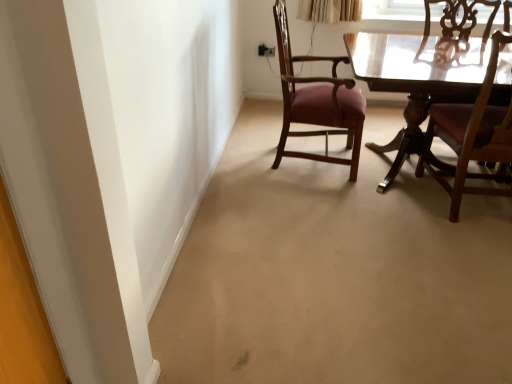
Question: Is wooden chair at right, the second chair viewed from the left, not close to purple upholstered chair at center, the 2th chair from the right?

Choices:
 (A) no
 (B) yes

Answer: (A)

Question: Can you confirm if wooden chair at right, the second chair viewed from the left, is positioned to the left of purple upholstered chair at center, which is counted as the first chair, starting from the left?

Choices:
 (A) no
 (B) yes

Answer: (A)

Question: Considering the relative sizes of wooden chair at right, the second chair viewed from the left, and purple upholstered chair at center, which is counted as the first chair, starting from the left, in the image provided, is wooden chair at right, the second chair viewed from the left, taller than purple upholstered chair at center, which is counted as the first chair, starting from the left,?

Choices:
 (A) no
 (B) yes

Answer: (A)

Question: Is wooden chair at right, placed as the first chair when sorted from right to left, wider than purple upholstered chair at center, which is counted as the first chair, starting from the left?

Choices:
 (A) yes
 (B) no

Answer: (B)

Question: Could you tell me if wooden chair at right, placed as the first chair when sorted from right to left, is turned towards purple upholstered chair at center, the 2th chair from the right?

Choices:
 (A) yes
 (B) no

Answer: (B)

Question: Is wooden chair at right, the second chair viewed from the left, thinner than purple upholstered chair at center, which is counted as the first chair, starting from the left?

Choices:
 (A) no
 (B) yes

Answer: (B)

Question: Considering the relative sizes of purple upholstered chair at center, which is counted as the first chair, starting from the left, and wooden chair at right, the second chair viewed from the left, in the image provided, is purple upholstered chair at center, which is counted as the first chair, starting from the left, shorter than wooden chair at right, the second chair viewed from the left,?

Choices:
 (A) yes
 (B) no

Answer: (B)

Question: Is the depth of purple upholstered chair at center, which is counted as the first chair, starting from the left, greater than that of wooden chair at right, the second chair viewed from the left?

Choices:
 (A) no
 (B) yes

Answer: (B)

Question: Are purple upholstered chair at center, which is counted as the first chair, starting from the left, and wooden chair at right, placed as the first chair when sorted from right to left, far apart?

Choices:
 (A) yes
 (B) no

Answer: (B)

Question: Is the position of purple upholstered chair at center, which is counted as the first chair, starting from the left, less distant than that of wooden chair at right, placed as the first chair when sorted from right to left?

Choices:
 (A) no
 (B) yes

Answer: (A)

Question: Could you tell me if purple upholstered chair at center, which is counted as the first chair, starting from the left, is facing wooden chair at right, placed as the first chair when sorted from right to left?

Choices:
 (A) yes
 (B) no

Answer: (A)

Question: Does purple upholstered chair at center, the 2th chair from the right, have a lesser width compared to wooden chair at right, the second chair viewed from the left?

Choices:
 (A) no
 (B) yes

Answer: (A)

Question: In terms of height, does purple upholstered chair at center, the 2th chair from the right, look taller or shorter compared to wooden chair at right, the second chair viewed from the left?

Choices:
 (A) tall
 (B) short

Answer: (A)